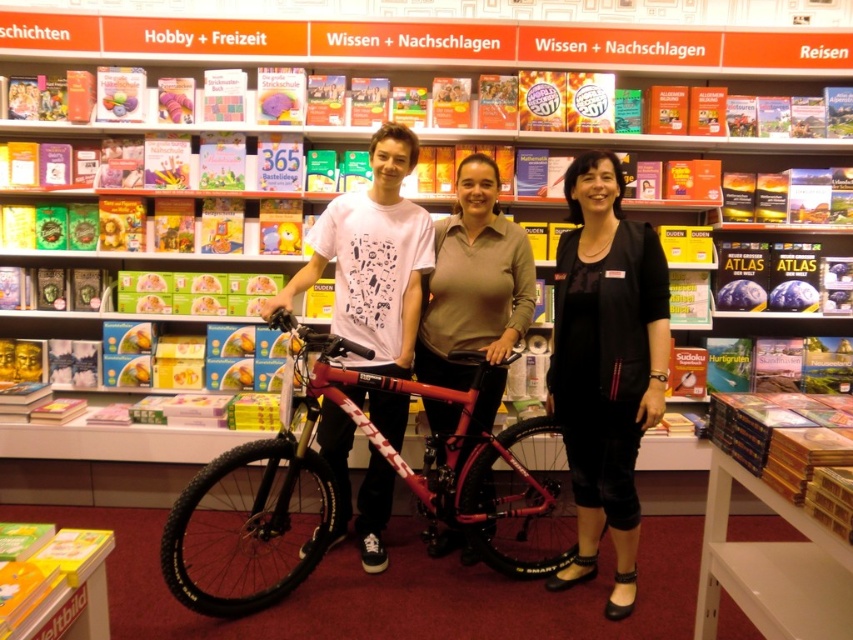
You are standing in the bookstore and want to place a new book on the shelf. You have two points marked on the shelf where you can place it. Which point is closer to you, point (608,464) or point (590,307)?

Point (608,464) is closer to you because it is further to the viewer than point (590,307).